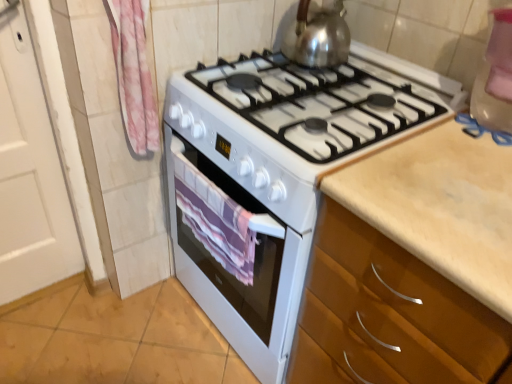
The height and width of the screenshot is (384, 512). Describe the element at coordinates (134, 75) in the screenshot. I see `pink fabric towel at left` at that location.

What is the approximate width of pink fabric towel at left?

The width of pink fabric towel at left is 9.13 centimeters.

What do you see at coordinates (318, 35) in the screenshot?
I see `shiny metallic kettle at upper center` at bounding box center [318, 35].

What do you see at coordinates (280, 173) in the screenshot? I see `white glossy stove at center` at bounding box center [280, 173].

Measure the distance between point (x=219, y=204) and camera.

The distance of point (x=219, y=204) from camera is 3.35 feet.

Locate an element on the screen. Image resolution: width=512 pixels, height=384 pixels. pink fabric towel at left is located at coordinates (134, 75).

Considering the relative positions of shiny metallic kettle at upper center and white glossy stove at center in the image provided, is shiny metallic kettle at upper center to the right of white glossy stove at center from the viewer's perspective?

Correct, you'll find shiny metallic kettle at upper center to the right of white glossy stove at center.

Image resolution: width=512 pixels, height=384 pixels. I want to click on appliance on the left of the shiny metallic kettle at upper center, so click(280, 173).

What's the angular difference between shiny metallic kettle at upper center and white glossy stove at center's facing directions?

They differ by 0.00219 degrees in their facing directions.

From a real-world perspective, does shiny metallic kettle at upper center stand above white glossy stove at center?

Indeed, from a real-world perspective, shiny metallic kettle at upper center stands above white glossy stove at center.

From the picture: Considering the relative positions of purple striped towel at center and white glossy stove at center in the image provided, is purple striped towel at center to the left or to the right of white glossy stove at center?

purple striped towel at center is to the left of white glossy stove at center.

The height and width of the screenshot is (384, 512). What are the coordinates of `appliance directly beneath the purple striped towel at center (from a real-world perspective)` in the screenshot? It's located at (280, 173).

Is purple striped towel at center outside of white glossy stove at center?

No, purple striped towel at center is not outside of white glossy stove at center.

Can you tell me how much purple striped towel at center and white glossy stove at center differ in facing direction?

0.0119 degrees separate the facing orientations of purple striped towel at center and white glossy stove at center.

Between point (264, 223) and point (153, 105), which one is positioned in front?

Positioned in front is point (264, 223).

From their relative heights in the image, would you say white glossy stove at center is taller or shorter than pink fabric towel at left?

Clearly, white glossy stove at center is taller compared to pink fabric towel at left.

Choose the correct answer: Is white glossy stove at center inside pink fabric towel at left or outside it?

white glossy stove at center exists outside the volume of pink fabric towel at left.

Is white glossy stove at center wider than pink fabric towel at left?

Yes.

Is white glossy stove at center inside the boundaries of purple striped towel at center, or outside?

white glossy stove at center lies outside purple striped towel at center.

Does white glossy stove at center turn towards purple striped towel at center?

Yes, white glossy stove at center faces towards purple striped towel at center.

Who is shorter, white glossy stove at center or purple striped towel at center?

purple striped towel at center is shorter.

Between white glossy stove at center and purple striped towel at center, which one has smaller size?

With smaller size is purple striped towel at center.

Who is more distant, purple striped towel at center or shiny metallic kettle at upper center?

Positioned behind is shiny metallic kettle at upper center.

Does purple striped towel at center have a lesser width compared to shiny metallic kettle at upper center?

Yes, purple striped towel at center is thinner than shiny metallic kettle at upper center.

Which point is more distant from viewer, (245, 221) or (298, 35)?

The point (298, 35) is more distant.

From the image's perspective, between purple striped towel at center and shiny metallic kettle at upper center, who is located below?

From the image's view, purple striped towel at center is below.

In the scene shown: Can you see shiny metallic kettle at upper center touching purple striped towel at center?

No, shiny metallic kettle at upper center is not touching purple striped towel at center.

From the image's perspective, which one is positioned higher, shiny metallic kettle at upper center or purple striped towel at center?

shiny metallic kettle at upper center appears higher in the image.

In the scene shown: Is shiny metallic kettle at upper center at the right side of purple striped towel at center?

Correct, you'll find shiny metallic kettle at upper center to the right of purple striped towel at center.

From a real-world perspective, is shiny metallic kettle at upper center above or below purple striped towel at center?

A: In terms of real-world spatial position, shiny metallic kettle at upper center is above purple striped towel at center.

Between white glossy stove at center and shiny metallic kettle at upper center, which one has more height?

Standing taller between the two is white glossy stove at center.

Does white glossy stove at center have a larger size compared to shiny metallic kettle at upper center?

Yes.

Considering the relative sizes of white glossy stove at center and shiny metallic kettle at upper center in the image provided, is white glossy stove at center wider than shiny metallic kettle at upper center?

Indeed, white glossy stove at center has a greater width compared to shiny metallic kettle at upper center.

Locate an element on the screen. kitchen appliance that is above the white glossy stove at center (from a real-world perspective) is located at coordinates (318, 35).

In order to click on blanket behind the white glossy stove at center in this screenshot , I will do `click(215, 220)`.

From the image, which object appears to be farther from pink fabric towel at left, white glossy stove at center or purple striped towel at center?

white glossy stove at center.

Considering their positions, is purple striped towel at center positioned further to shiny metallic kettle at upper center than white glossy stove at center?

purple striped towel at center is further to shiny metallic kettle at upper center.

Looking at the image, which one is located further to white glossy stove at center, pink fabric towel at left or shiny metallic kettle at upper center?

pink fabric towel at left.

Which object lies nearer to the anchor point shiny metallic kettle at upper center, white glossy stove at center or purple striped towel at center?

white glossy stove at center is closer to shiny metallic kettle at upper center.

From the image, which object appears to be nearer to white glossy stove at center, shiny metallic kettle at upper center or pink fabric towel at left?

shiny metallic kettle at upper center is positioned closer to the anchor white glossy stove at center.

From the image, which object appears to be farther from white glossy stove at center, shiny metallic kettle at upper center or purple striped towel at center?

shiny metallic kettle at upper center is positioned further to the anchor white glossy stove at center.

From the image, which object appears to be farther from shiny metallic kettle at upper center, white glossy stove at center or pink fabric towel at left?

pink fabric towel at left.

When comparing their distances from purple striped towel at center, does shiny metallic kettle at upper center or pink fabric towel at left seem closer?

The object closer to purple striped towel at center is pink fabric towel at left.

Identify the location of curtain that lies between shiny metallic kettle at upper center and white glossy stove at center from top to bottom. (134, 75).

Where is `curtain that lies between shiny metallic kettle at upper center and purple striped towel at center from top to bottom`? curtain that lies between shiny metallic kettle at upper center and purple striped towel at center from top to bottom is located at coordinates (134, 75).

What are the coordinates of `blanket between pink fabric towel at left and white glossy stove at center from left to right` in the screenshot? It's located at click(x=215, y=220).

In order to click on blanket between shiny metallic kettle at upper center and white glossy stove at center from top to bottom in this screenshot , I will do `click(215, 220)`.